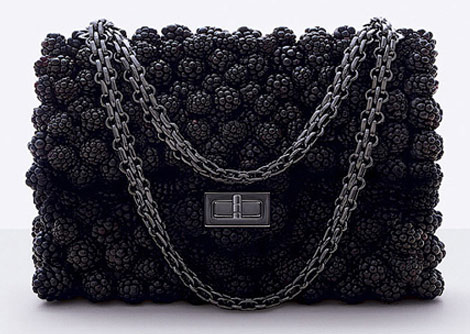
I want to click on white floor, so click(185, 321).